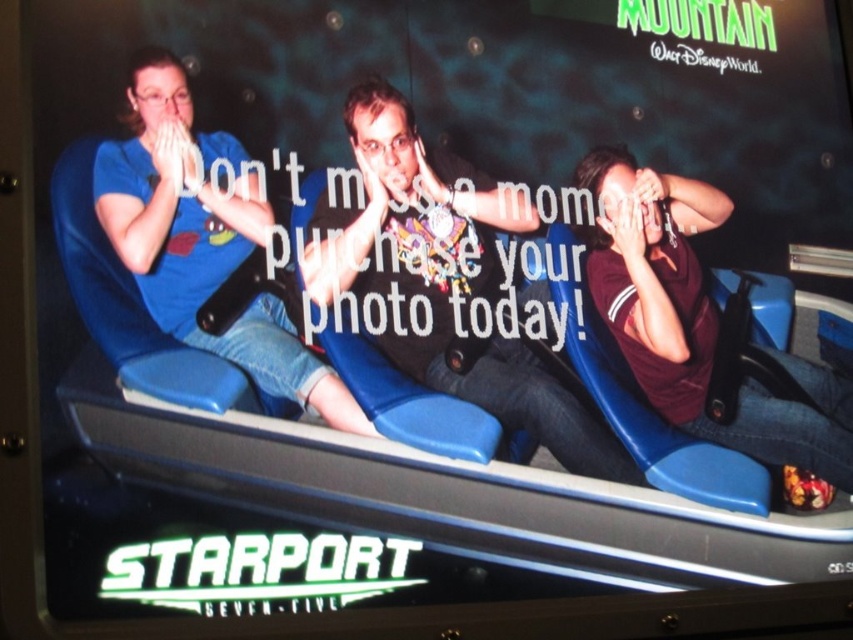
Question: Which point is farther to the camera?

Choices:
 (A) (637, 228)
 (B) (479, 256)

Answer: (A)

Question: Which of the following is the farthest from the observer?

Choices:
 (A) (805, 435)
 (B) (395, 100)
 (C) (242, 316)

Answer: (A)

Question: Which of the following is the closest to the observer?

Choices:
 (A) matte black shirt at center
 (B) maroon jersey at right

Answer: (A)

Question: Can you confirm if matte black shirt at center is positioned to the left of matte blue jeans at left?

Choices:
 (A) no
 (B) yes

Answer: (A)

Question: Does matte blue jeans at left have a smaller size compared to maroon jersey at right?

Choices:
 (A) yes
 (B) no

Answer: (A)

Question: Is matte blue jeans at left to the right of maroon jersey at right from the viewer's perspective?

Choices:
 (A) yes
 (B) no

Answer: (B)